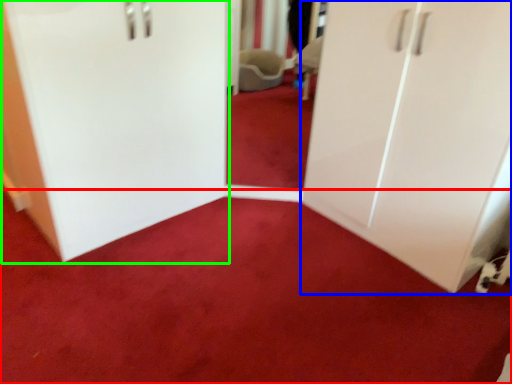
Question: Which is farther away from plain (highlighted by a red box)? cupboard (highlighted by a blue box) or door (highlighted by a green box)?

Choices:
 (A) cupboard
 (B) door

Answer: (B)